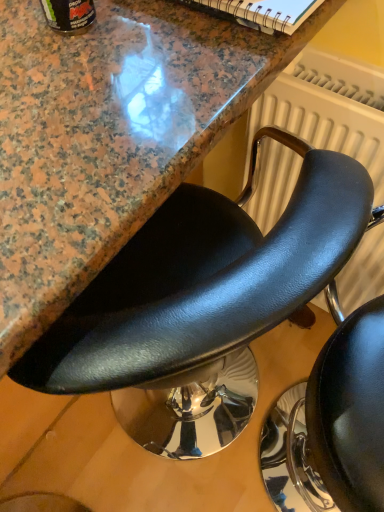
At what (x,y) coordinates should I click in order to perform the action: click on black leather chair at center, arranged as the first chair when viewed from the left. Please return your answer as a coordinate pair (x, y). Looking at the image, I should click on (203, 280).

What are the coordinates of `black leather chair at center, marked as the 2th chair in a left-to-right arrangement` in the screenshot? It's located at (332, 422).

The width and height of the screenshot is (384, 512). Identify the location of white textured radiator at upper right. (328, 109).

How different are the orientations of black leather chair at center, marked as the 2th chair in a left-to-right arrangement, and white textured radiator at upper right in degrees?

There is a 87.9-degree angle between the facing directions of black leather chair at center, marked as the 2th chair in a left-to-right arrangement, and white textured radiator at upper right.

From a real-world perspective, is black leather chair at center, marked as the 2th chair in a left-to-right arrangement, above or below white textured radiator at upper right?

Clearly, from a real-world perspective, black leather chair at center, marked as the 2th chair in a left-to-right arrangement, is below white textured radiator at upper right.

Considering the sizes of black leather chair at center, marked as the 2th chair in a left-to-right arrangement, and white textured radiator at upper right in the image, is black leather chair at center, marked as the 2th chair in a left-to-right arrangement, taller or shorter than white textured radiator at upper right?

black leather chair at center, marked as the 2th chair in a left-to-right arrangement, is taller than white textured radiator at upper right.

Considering the relative positions of black leather chair at center, the 1th chair viewed from the right, and white textured radiator at upper right in the image provided, is black leather chair at center, the 1th chair viewed from the right, to the left of white textured radiator at upper right from the viewer's perspective?

Incorrect, black leather chair at center, the 1th chair viewed from the right, is not on the left side of white textured radiator at upper right.

Is point (350, 114) closer to camera compared to point (267, 244)?

No, it is not.

From the image's perspective, is white textured radiator at upper right positioned above or below black leather chair at center, arranged as the first chair when viewed from the left?

Answer: white textured radiator at upper right is situated higher than black leather chair at center, arranged as the first chair when viewed from the left, in the image.

Is black leather chair at center, the second chair positioned from the right, a part of white textured radiator at upper right?

No, black leather chair at center, the second chair positioned from the right, is located outside of white textured radiator at upper right.

Considering the relative sizes of white textured radiator at upper right and black leather chair at center, the second chair positioned from the right, in the image provided, is white textured radiator at upper right smaller than black leather chair at center, the second chair positioned from the right,?

Correct, white textured radiator at upper right occupies less space than black leather chair at center, the second chair positioned from the right.

Based on their sizes in the image, would you say black leather chair at center, arranged as the first chair when viewed from the left, is bigger or smaller than black leather chair at center, the 1th chair viewed from the right?

Considering their sizes, black leather chair at center, arranged as the first chair when viewed from the left, takes up more space than black leather chair at center, the 1th chair viewed from the right.

In the image, is black leather chair at center, arranged as the first chair when viewed from the left, positioned in front of or behind black leather chair at center, marked as the 2th chair in a left-to-right arrangement?

Visually, black leather chair at center, arranged as the first chair when viewed from the left, is located behind black leather chair at center, marked as the 2th chair in a left-to-right arrangement.

Considering the positions of point (314, 207) and point (332, 437), is point (314, 207) closer or farther from the camera than point (332, 437)?

Point (314, 207) is closer to the camera than point (332, 437).

Considering the relative sizes of black leather chair at center, the second chair positioned from the right, and black leather chair at center, marked as the 2th chair in a left-to-right arrangement, in the image provided, is black leather chair at center, the second chair positioned from the right, shorter than black leather chair at center, marked as the 2th chair in a left-to-right arrangement,?

Yes, black leather chair at center, the second chair positioned from the right, is shorter than black leather chair at center, marked as the 2th chair in a left-to-right arrangement.

From the image's perspective, which one is positioned lower, white textured radiator at upper right or black leather chair at center, marked as the 2th chair in a left-to-right arrangement?

From the image's view, black leather chair at center, marked as the 2th chair in a left-to-right arrangement, is below.

Can you confirm if white textured radiator at upper right is taller than black leather chair at center, marked as the 2th chair in a left-to-right arrangement?

No.

From a real-world perspective, is white textured radiator at upper right physically located above or below black leather chair at center, marked as the 2th chair in a left-to-right arrangement?

white textured radiator at upper right is above black leather chair at center, marked as the 2th chair in a left-to-right arrangement.

Consider the image. Do you think black leather chair at center, the 1th chair viewed from the right, is within black leather chair at center, arranged as the first chair when viewed from the left, or outside of it?

black leather chair at center, the 1th chair viewed from the right, is not inside black leather chair at center, arranged as the first chair when viewed from the left, it's outside.

Is black leather chair at center, the second chair positioned from the right, at the back of black leather chair at center, the 1th chair viewed from the right?

Yes, black leather chair at center, the second chair positioned from the right, is at the back of black leather chair at center, the 1th chair viewed from the right.

Based on the photo, in terms of width, does black leather chair at center, the 1th chair viewed from the right, look wider or thinner when compared to black leather chair at center, the second chair positioned from the right?

In the image, black leather chair at center, the 1th chair viewed from the right, appears to be more narrow than black leather chair at center, the second chair positioned from the right.

In terms of size, does black leather chair at center, arranged as the first chair when viewed from the left, appear bigger or smaller than white textured radiator at upper right?

Clearly, black leather chair at center, arranged as the first chair when viewed from the left, is larger in size than white textured radiator at upper right.

Is black leather chair at center, the second chair positioned from the right, shorter than white textured radiator at upper right?

No.

Which is in front, black leather chair at center, the second chair positioned from the right, or white textured radiator at upper right?

Positioned in front is black leather chair at center, the second chair positioned from the right.

Locate an element on the screen. This screenshot has height=512, width=384. the 1st chair below the white textured radiator at upper right (from a real-world perspective) is located at coordinates point(332,422).

I want to click on chair on the left of white textured radiator at upper right, so click(203, 280).

Which object lies further to the anchor point black leather chair at center, the second chair positioned from the right, black leather chair at center, marked as the 2th chair in a left-to-right arrangement, or white textured radiator at upper right?

black leather chair at center, marked as the 2th chair in a left-to-right arrangement, lies further to black leather chair at center, the second chair positioned from the right, than the other object.

In the scene shown: From the image, which object appears to be nearer to white textured radiator at upper right, black leather chair at center, arranged as the first chair when viewed from the left, or black leather chair at center, marked as the 2th chair in a left-to-right arrangement?

black leather chair at center, arranged as the first chair when viewed from the left, is closer to white textured radiator at upper right.

Consider the image. Looking at the image, which one is located further to black leather chair at center, the second chair positioned from the right, white textured radiator at upper right or black leather chair at center, the 1th chair viewed from the right?

black leather chair at center, the 1th chair viewed from the right, is further to black leather chair at center, the second chair positioned from the right.

Which object lies further to the anchor point black leather chair at center, the 1th chair viewed from the right, black leather chair at center, the second chair positioned from the right, or white textured radiator at upper right?

black leather chair at center, the second chair positioned from the right.

Estimate the real-world distances between objects in this image. Which object is closer to black leather chair at center, the 1th chair viewed from the right, white textured radiator at upper right or black leather chair at center, arranged as the first chair when viewed from the left?

The object closer to black leather chair at center, the 1th chair viewed from the right, is white textured radiator at upper right.

Based on their spatial positions, is black leather chair at center, marked as the 2th chair in a left-to-right arrangement, or black leather chair at center, arranged as the first chair when viewed from the left, further from white textured radiator at upper right?

black leather chair at center, marked as the 2th chair in a left-to-right arrangement.

What are the coordinates of `radiator located between black leather chair at center, arranged as the first chair when viewed from the left, and black leather chair at center, marked as the 2th chair in a left-to-right arrangement, in the left-right direction` in the screenshot? It's located at (328, 109).